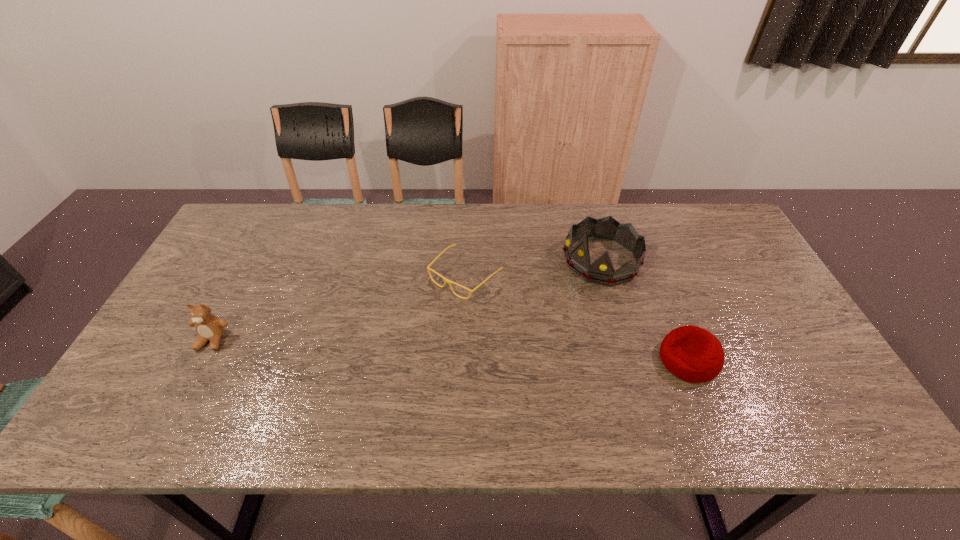
Identify the location of free spot located at the front of the tallest object with jewels. This screenshot has width=960, height=540. (532, 303).

I want to click on vacant space located at the front of the tallest object with jewels, so click(x=469, y=343).

This screenshot has width=960, height=540. I want to click on free spot located in front of the lenses of the second object from left to right, so click(398, 339).

Find the location of `vacant space located 0.090m in front of the lenses of the second object from left to right`. vacant space located 0.090m in front of the lenses of the second object from left to right is located at coordinates (421, 318).

I want to click on vacant space located 0.160m in front of the lenses of the second object from left to right, so click(x=403, y=334).

Identify the location of object that is at the far edge. This screenshot has width=960, height=540. (601, 271).

Where is `object at the near edge`? object at the near edge is located at coordinates (693, 354).

At what (x,y) coordinates should I click in order to perform the action: click on object that is at the left edge. Please return your answer as a coordinate pair (x, y). Looking at the image, I should click on (210, 328).

Identify the location of free space at the far edge of the desktop. (324, 245).

Image resolution: width=960 pixels, height=540 pixels. In the image, there is a desktop. In order to click on vacant space at the near edge in this screenshot , I will do `click(425, 381)`.